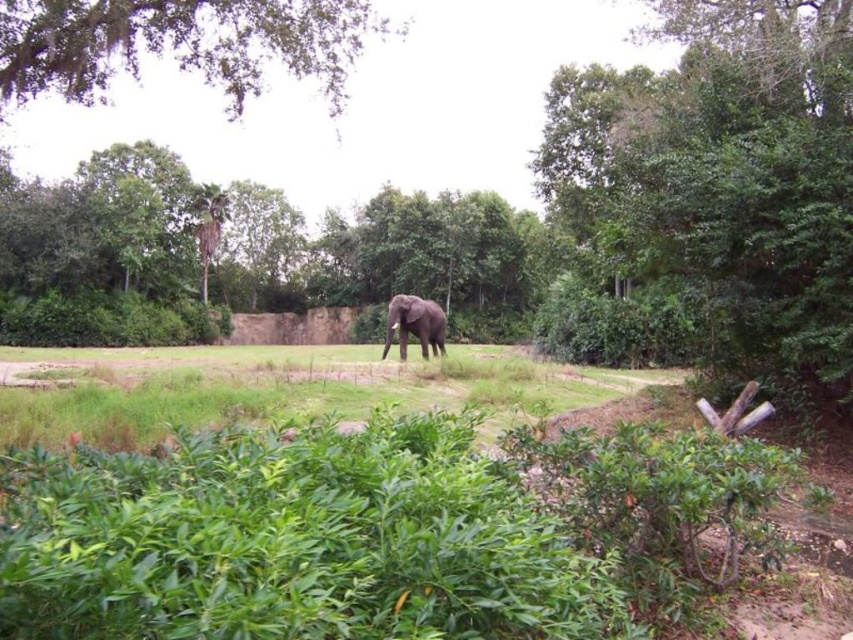
You are a zookeeper planning to place a new feeding station in the enclosure. The feeding station must be placed between the green grass at center and the green leafy tree at upper left. Based on their positions, which object should the feeding station be closer to if it needs to be aligned with the right side of the enclosure?

The feeding station should be closer to the green grass at center because it is already positioned to the right of the green leafy tree at upper left, so aligning it with the right side of the enclosure would place it near the green grass at center.